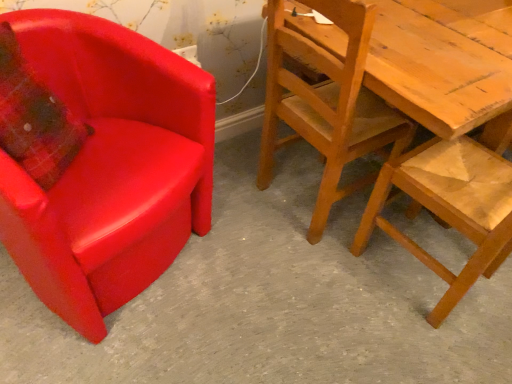
You are a GUI agent. You are given a task and a screenshot of the screen. Output one action in this format:
    pyautogui.click(x=<x>, y=<y>)
    Task: Click on the empty space that is in between matte red armchair at left, marked as the first chair in a left-to-right arrangement, and wooden textured chair at right, which is the 1th chair from right to left
    
    Given the screenshot: What is the action you would take?
    pyautogui.click(x=284, y=293)